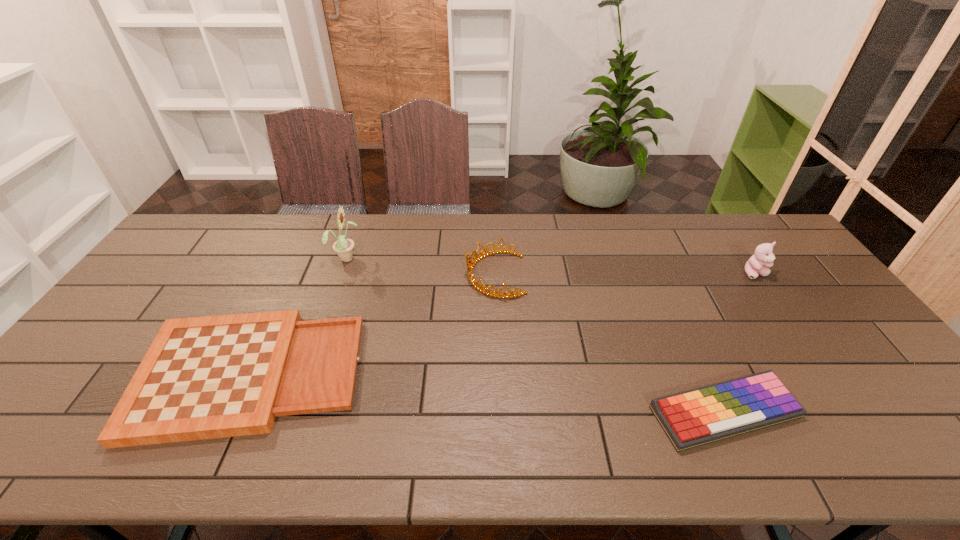
At what (x,y) coordinates should I click in order to perform the action: click on free space at the near edge. Please return your answer as a coordinate pair (x, y). Looking at the image, I should click on (388, 434).

Locate an element on the screen. vacant space at the left edge of the desktop is located at coordinates tap(161, 310).

This screenshot has height=540, width=960. In the image, there is a desktop. Identify the location of vacant space at the right edge. (778, 276).

Locate an element on the screen. The width and height of the screenshot is (960, 540). free space at the far right corner is located at coordinates (718, 214).

At what (x,y) coordinates should I click in order to perform the action: click on vacant space that is in between the rightmost object and the computer keyboard. Please return your answer as a coordinate pair (x, y). This screenshot has width=960, height=540. Looking at the image, I should click on (740, 343).

Where is `free spot between the second object from right to left and the sunflower`? The width and height of the screenshot is (960, 540). free spot between the second object from right to left and the sunflower is located at coordinates (536, 335).

You are a GUI agent. You are given a task and a screenshot of the screen. Output one action in this format:
    pyautogui.click(x=<x>, y=<y>)
    Task: Click on the free spot between the third shortest object and the fourth shortest object
    Image resolution: width=960 pixels, height=540 pixels.
    Given the screenshot: What is the action you would take?
    pyautogui.click(x=625, y=274)

Find the location of `free point between the third object from right to left and the rightmost object`. free point between the third object from right to left and the rightmost object is located at coordinates (625, 274).

At what (x,y) coordinates should I click in order to perform the action: click on blank region between the rightmost object and the sunflower. Please return your answer as a coordinate pair (x, y). Image resolution: width=960 pixels, height=540 pixels. Looking at the image, I should click on (551, 266).

Where is `vacant area that lies between the computer keyboard and the gameboard`? The width and height of the screenshot is (960, 540). vacant area that lies between the computer keyboard and the gameboard is located at coordinates (488, 394).